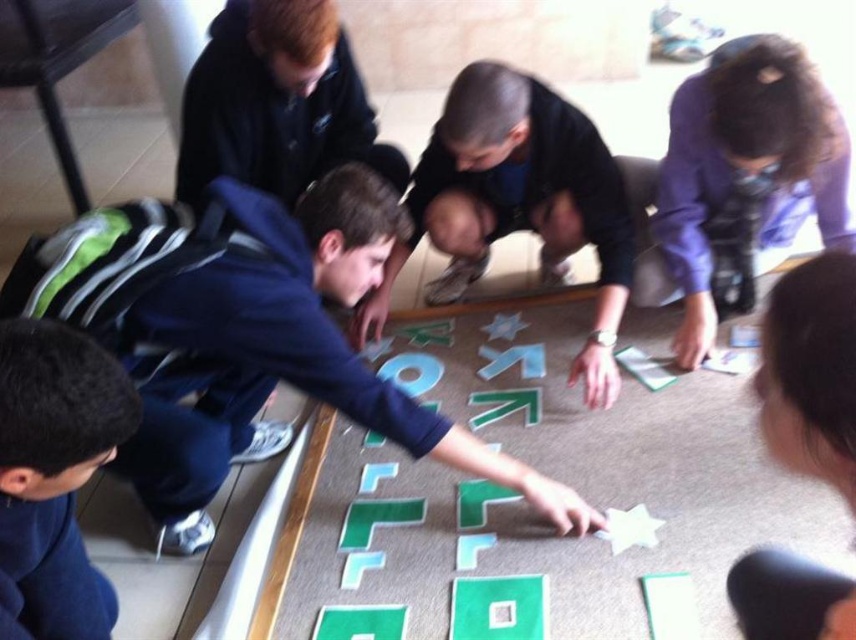
Where is `dark blue shirt at center`? The width and height of the screenshot is (856, 640). dark blue shirt at center is located at coordinates (519, 202).

Which is behind, point (536, 225) or point (93, 584)?

The point (536, 225) is more distant.

At what (x,y) coordinates should I click in order to perform the action: click on dark blue shirt at center. Please return your answer as a coordinate pair (x, y). This screenshot has width=856, height=640. Looking at the image, I should click on (519, 202).

Does purple fabric at upper right appear under black matte hair at lower left?

Incorrect, purple fabric at upper right is not positioned below black matte hair at lower left.

In the scene shown: Which of these two, purple fabric at upper right or black matte hair at lower left, stands shorter?

black matte hair at lower left is shorter.

Is point (739, 132) closer to camera compared to point (21, 625)?

No, it is not.

Image resolution: width=856 pixels, height=640 pixels. I want to click on purple fabric at upper right, so click(747, 170).

Which is behind, point (550, 250) or point (726, 99)?

Point (550, 250)

Between point (500, 208) and point (831, 179), which one is positioned in front?

Positioned in front is point (831, 179).

Is point (421, 202) closer to viewer compared to point (779, 67)?

No, (421, 202) is further to viewer.

Where is `dark blue shirt at center`? dark blue shirt at center is located at coordinates (519, 202).